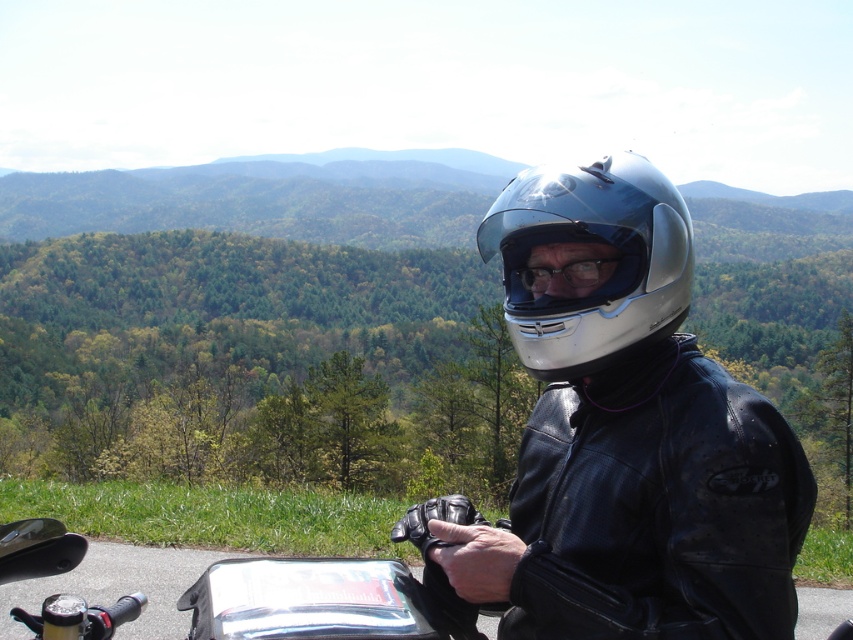
Between black leather jacket at right and transparent plastic goggles at center, which one is positioned higher?

Positioned higher is transparent plastic goggles at center.

Measure the distance between point (552, 397) and camera.

The distance of point (552, 397) from camera is 5.35 feet.

Does point (535, 588) come closer to viewer compared to point (598, 262)?

Yes, it is.

Identify the location of black leather jacket at right. The image size is (853, 640). (657, 506).

Is point (630, 509) farther from camera compared to point (625, 250)?

No, it is in front of (625, 250).

Between black leather jacket at right and glossy white helmet at center, which one has more height?

black leather jacket at right

Does point (627, 582) lie in front of point (515, 205)?

Yes.

You are a GUI agent. You are given a task and a screenshot of the screen. Output one action in this format:
    pyautogui.click(x=<x>, y=<y>)
    Task: Click on the black leather jacket at right
    Image resolution: width=853 pixels, height=640 pixels.
    Given the screenshot: What is the action you would take?
    pyautogui.click(x=657, y=506)

Is glossy black helmet at center in front of black leather jacket at right?

Yes, glossy black helmet at center is in front of black leather jacket at right.

Is glossy black helmet at center taller than black leather jacket at right?

Yes.

The image size is (853, 640). I want to click on glossy black helmet at center, so [622, 438].

Where is `glossy black helmet at center`? glossy black helmet at center is located at coordinates (622, 438).